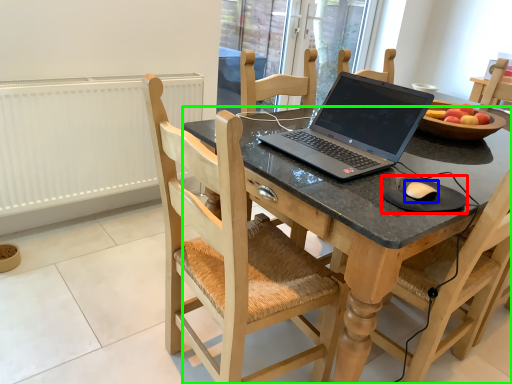
Question: Considering the real-world distances, which object is closest to mousepad (highlighted by a red box)? mouse (highlighted by a blue box) or desk (highlighted by a green box).

Choices:
 (A) mouse
 (B) desk

Answer: (A)